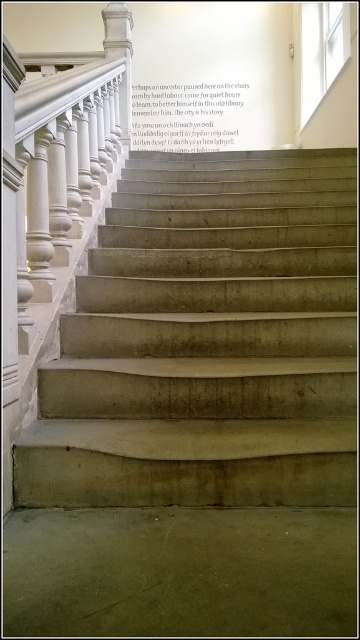
Does concrete stairs at center have a larger size compared to white marble pillar at upper center?

Correct, concrete stairs at center is larger in size than white marble pillar at upper center.

Who is lower down, concrete stairs at center or white marble pillar at upper center?

concrete stairs at center is lower down.

Who is more forward, (236, 248) or (128, 140)?

Point (236, 248) is in front.

Find the location of a particular element. Image resolution: width=360 pixels, height=640 pixels. concrete stairs at center is located at coordinates (208, 340).

Is concrete stairs at center to the right of brown concrete floor at lower center from the viewer's perspective?

Indeed, concrete stairs at center is positioned on the right side of brown concrete floor at lower center.

Between concrete stairs at center and brown concrete floor at lower center, which one appears on the left side from the viewer's perspective?

brown concrete floor at lower center is more to the left.

I want to click on concrete stairs at center, so click(208, 340).

Identify the location of brown concrete floor at lower center. (180, 572).